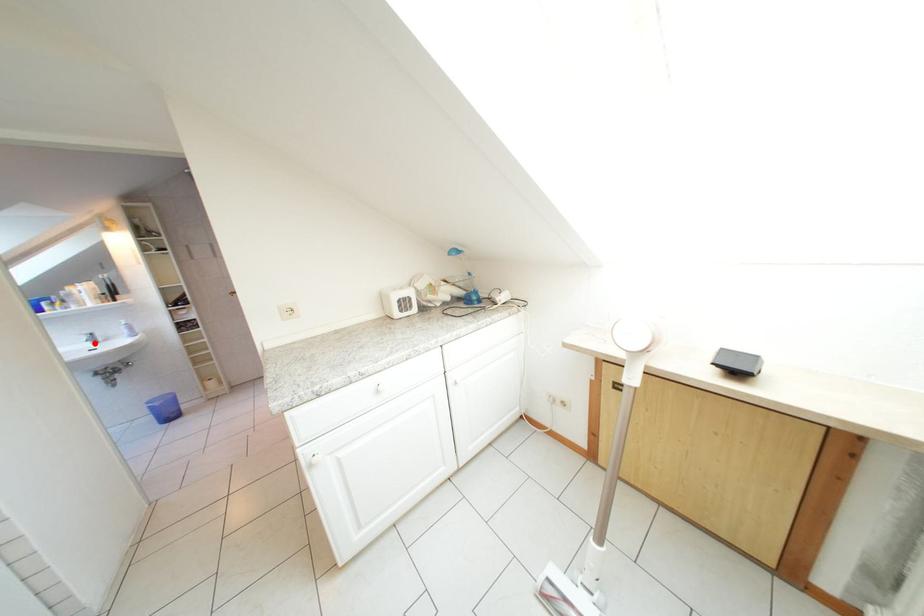
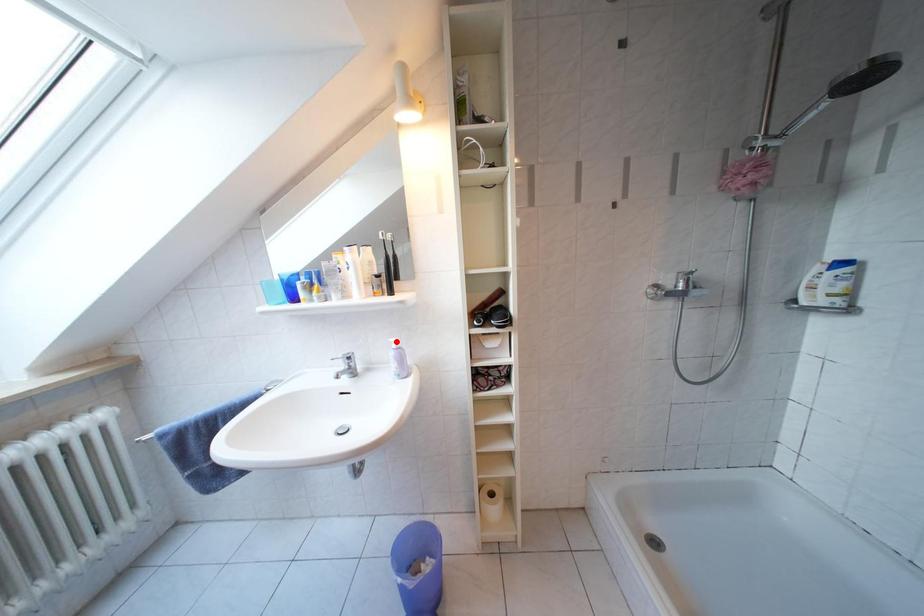
I am providing you with two images of the same scene from different viewpoints. A red point is marked on the first image and another point is marked on the second image. Is the red point in image1 aligned with the point shown in image2?

No